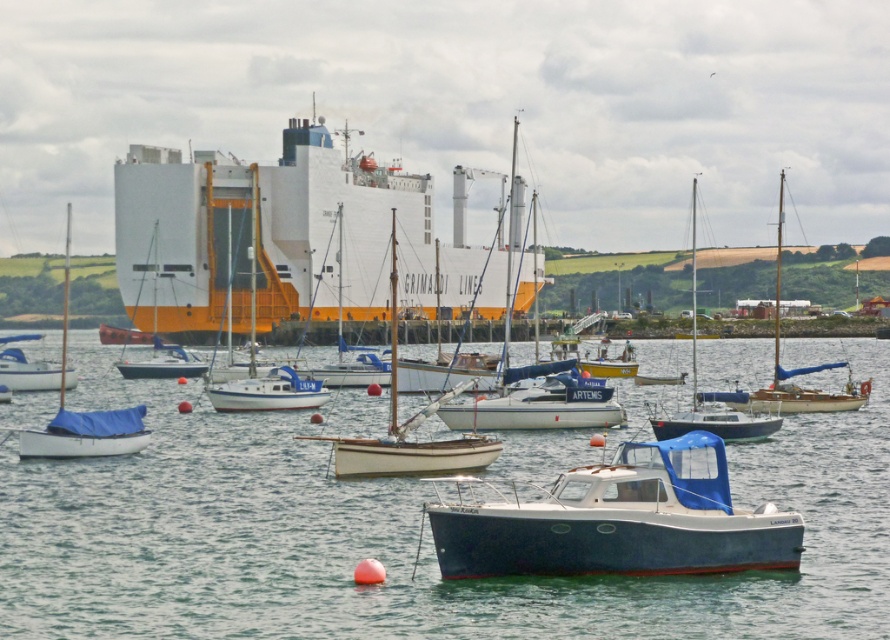
Is blue matte boat at center smaller than white matte sailboat at left?

Yes, blue matte boat at center is smaller than white matte sailboat at left.

Is blue matte boat at center to the right of white matte sailboat at left from the viewer's perspective?

Correct, you'll find blue matte boat at center to the right of white matte sailboat at left.

I want to click on blue matte boat at center, so click(x=621, y=520).

Looking at this image, can you confirm if blue water at center is positioned below white matte sailboat at center?

Yes, blue water at center is below white matte sailboat at center.

You are a GUI agent. You are given a task and a screenshot of the screen. Output one action in this format:
    pyautogui.click(x=<x>, y=<y>)
    Task: Click on the blue water at center
    This screenshot has width=890, height=640.
    Given the screenshot: What is the action you would take?
    pyautogui.click(x=399, y=531)

Can you confirm if blue water at center is positioned below white wood sailboat at center?

Yes, blue water at center is below white wood sailboat at center.

The height and width of the screenshot is (640, 890). Describe the element at coordinates (399, 531) in the screenshot. I see `blue water at center` at that location.

Who is more distant from viewer, (x=814, y=420) or (x=361, y=474)?

The point (x=814, y=420) is behind.

Identify the location of blue water at center. (399, 531).